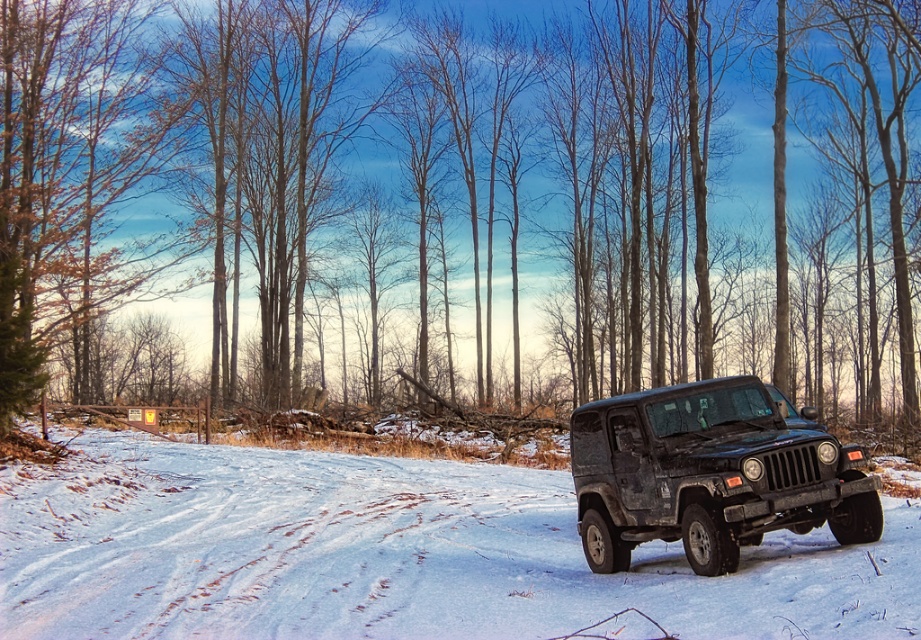
You are standing at the point labeled point (442, 280) and want to walk to the point labeled point (731, 534). Which direction should you face to move towards your destination?

Since point (442, 280) is closer to you than point (731, 534), you should face away from yourself towards point (731, 534) to move towards it.

You are a delivery driver who needs to park your matte black jeep at center on the white powdery snow at center. Will the snow underneath the vehicle be visible once parked?

The white powdery snow at center is positioned under the matte black jeep at center, so when parked, the snow underneath will be covered by the vehicle and thus not visible.

You are standing at the point closer to the camera in the snowy landscape scene. Which point are you at, point (838, 332) or point (197, 579)?

You are at point (838, 332) because it is further to the camera than point (197, 579).